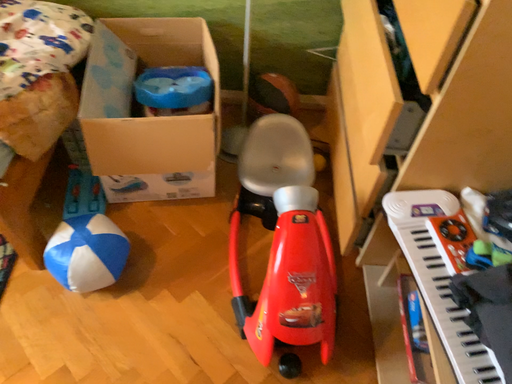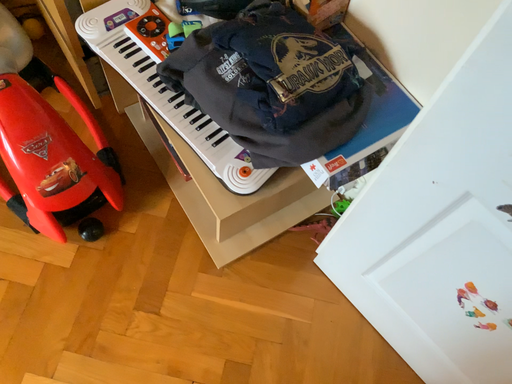
Question: Which way did the camera rotate in the video?

Choices:
 (A) rotated downward
 (B) rotated upward

Answer: (A)